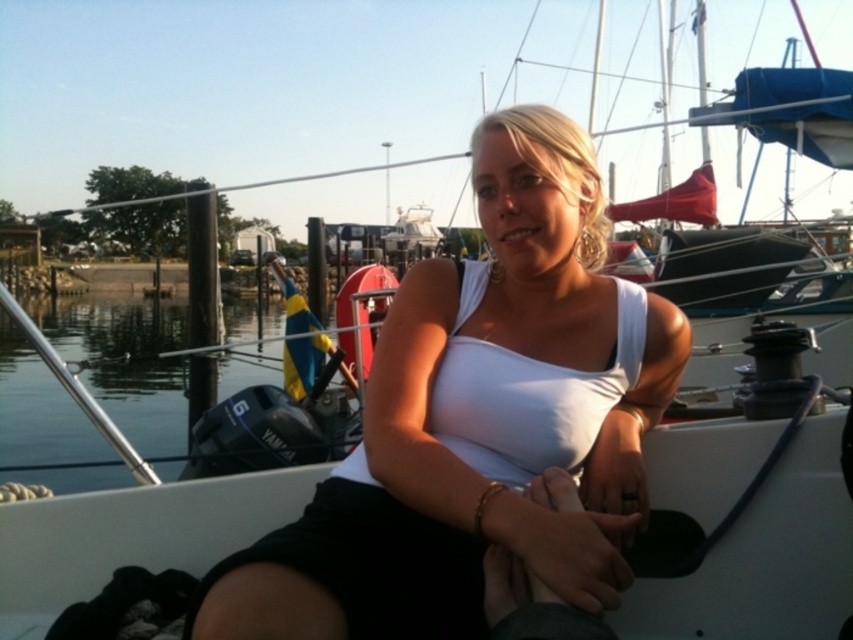
Which is more to the left, white matte tank top at center or clear water at lower left?

From the viewer's perspective, clear water at lower left appears more on the left side.

Find the location of a particular element. white matte tank top at center is located at coordinates (479, 420).